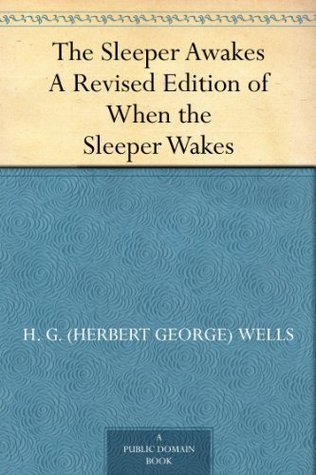
You are a GUI agent. You are given a task and a screenshot of the screen. Output one action in this format:
    pyautogui.click(x=<x>, y=<y>)
    Task: Click on the book
    
    Given the screenshot: What is the action you would take?
    pyautogui.click(x=77, y=232)